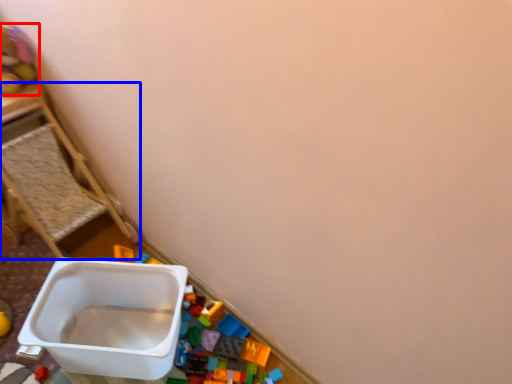
Question: Among these objects, which one is farthest to the camera, toy (highlighted by a red box) or furniture (highlighted by a blue box)?

Choices:
 (A) toy
 (B) furniture

Answer: (A)